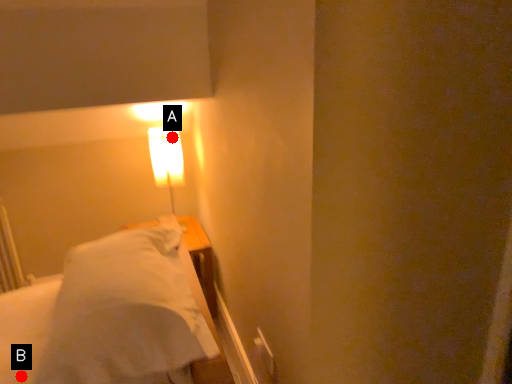
Question: Two points are circled on the image, labeled by A and B beside each circle. Which point appears farthest from the camera in this image?

Choices:
 (A) A is further
 (B) B is further

Answer: (A)